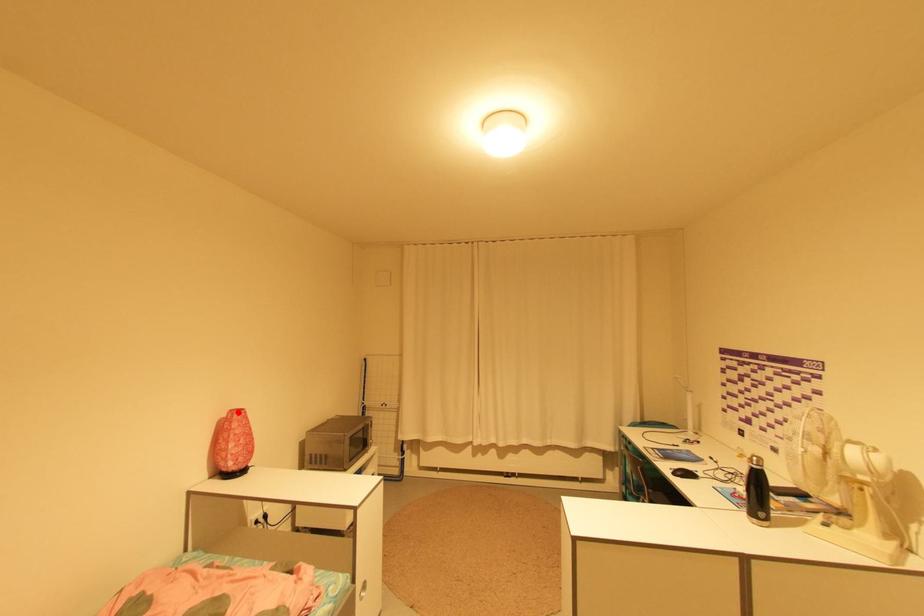
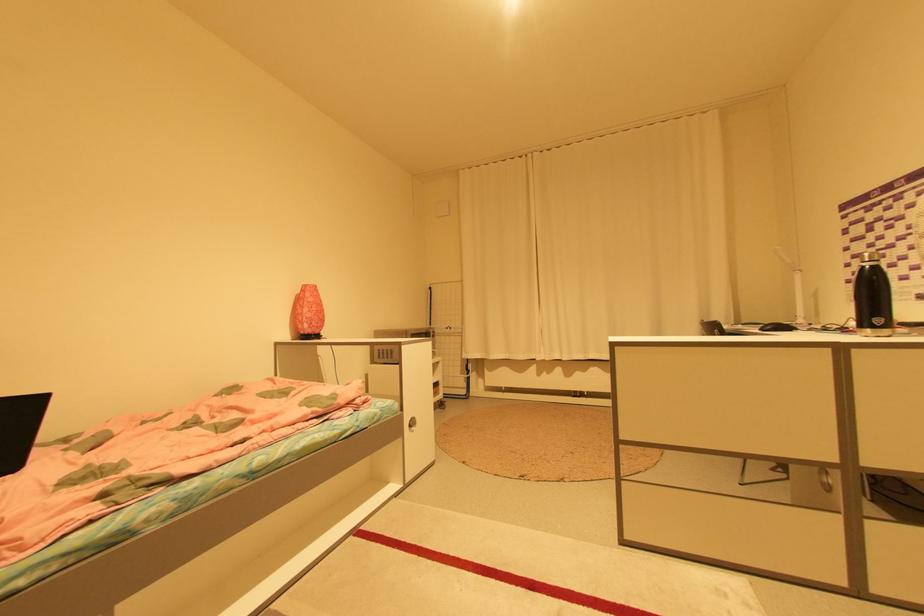
Where in the second image is the point corresponding to the highlighted location from the first image?

(311, 285)